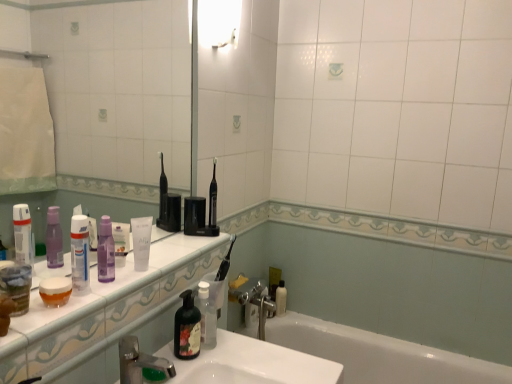
You are a GUI agent. You are given a task and a screenshot of the screen. Output one action in this format:
    pyautogui.click(x=<x>, y=<y>)
    Task: Click on the free spot behind purple matte bottle at center
    The width and height of the screenshot is (512, 384).
    Given the screenshot: What is the action you would take?
    pyautogui.click(x=151, y=261)